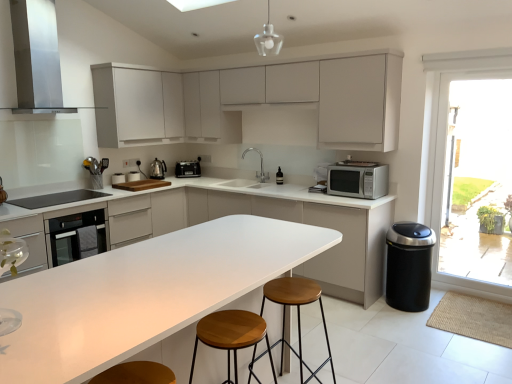
At what (x,y) coordinates should I click in order to perform the action: click on blank space situated above white laminate countertop at center (from a real-world perspective). Please return your answer as a coordinate pair (x, y). This screenshot has width=512, height=384. Looking at the image, I should click on (170, 265).